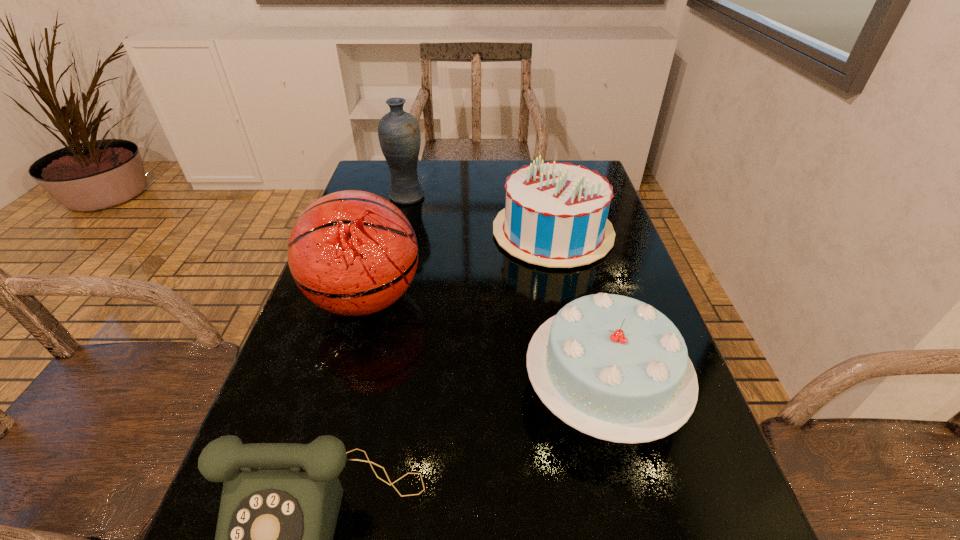
In order to click on vacant space that satisfies the following two spatial constraints: 1. on the side with spill of the nearer birthday cake; 2. on the left side of the basketball in this screenshot , I will do `click(340, 390)`.

Where is `vacant space that satisfies the following two spatial constraints: 1. on the side with spill of the nearer birthday cake; 2. on the left side of the basketball`? The height and width of the screenshot is (540, 960). vacant space that satisfies the following two spatial constraints: 1. on the side with spill of the nearer birthday cake; 2. on the left side of the basketball is located at coordinates (340, 390).